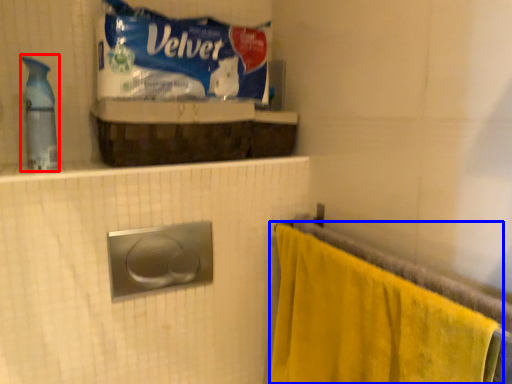
Question: Which of the following is the farthest to the observer, cleaning product (highlighted by a red box) or towel (highlighted by a blue box)?

Choices:
 (A) cleaning product
 (B) towel

Answer: (A)